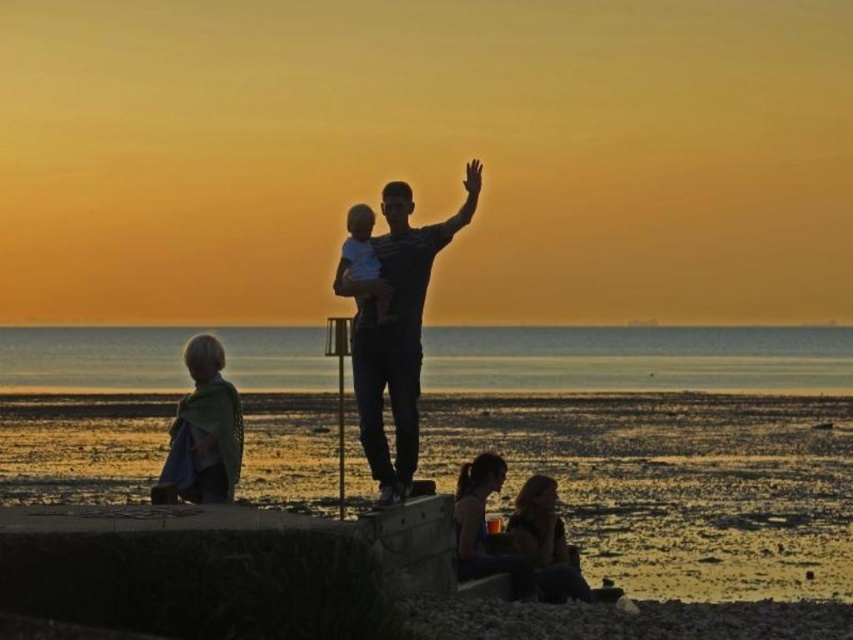
Question: Which of the following is the closest to the observer?

Choices:
 (A) (354, 220)
 (B) (192, 349)
 (C) (456, 504)

Answer: (A)

Question: Does smooth leather jacket at lower right appear on the left side of blonde hair fabric child at lower left?

Choices:
 (A) yes
 (B) no

Answer: (B)

Question: Among these objects, which one is farthest from the camera?

Choices:
 (A) blonde hair fabric child at lower left
 (B) smooth leather jacket at lower right
 (C) matte black shirt at center

Answer: (B)

Question: Can you confirm if smooth leather jacket at lower right is positioned above smooth white baby at center?

Choices:
 (A) yes
 (B) no

Answer: (B)

Question: Can you confirm if blonde hair fabric child at lower left is positioned to the right of smooth white baby at center?

Choices:
 (A) no
 (B) yes

Answer: (A)

Question: Among these points, which one is farthest from the camera?

Choices:
 (A) [526, 557]
 (B) [405, 330]
 (C) [366, 212]
 (D) [184, 448]

Answer: (A)